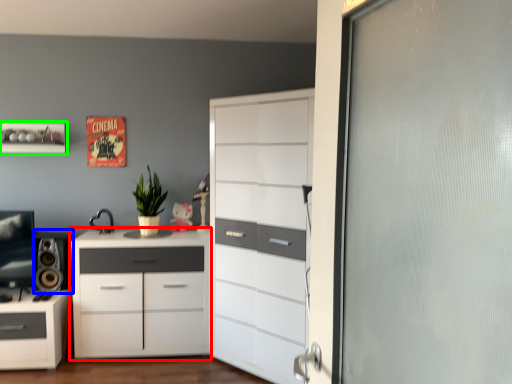
Question: Which object is positioned farthest from chest of drawers (highlighted by a red box)? Select from speaker (highlighted by a blue box) and shelf (highlighted by a green box).

Choices:
 (A) speaker
 (B) shelf

Answer: (B)